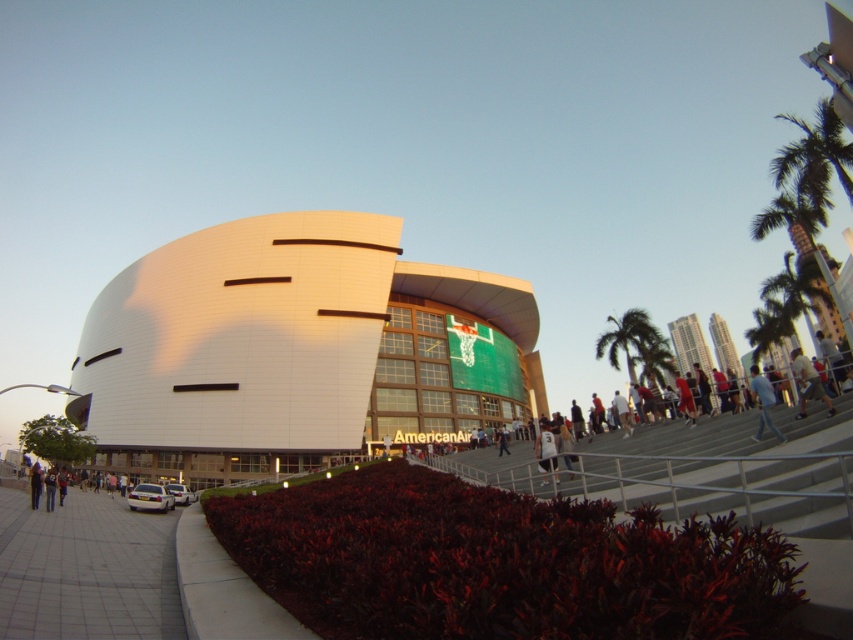
You are standing at the entrance of the arena and see two people wearing blue jeans at lower right and dark blue jeans at lower left. Which person is closer to the right side of the walkway?

The blue jeans at lower right is to the right of dark blue jeans at lower left, so the person wearing blue jeans at lower right is closer to the right side of the walkway.

You are standing at the entrance of the arena and see the green leafy palm tree at upper right and the light blue jeans at right. Which object is closer to you?

The green leafy palm tree at upper right is closer to you because the light blue jeans at right is behind it.

You are standing at the entrance of the arena and want to take a photo of the green leafy palm tree at upper right without including the light blue jeans at right in the frame. Is it possible to do so based on their positions?

The green leafy palm tree at upper right is positioned over light blue jeans at right, so if you angle your camera upwards to focus on the upper part of the palm tree, you can exclude the light blue jeans at right from the photo.